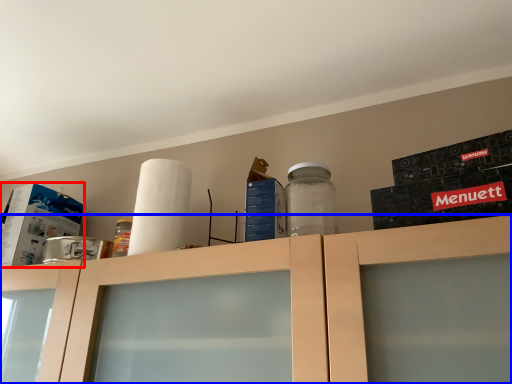
Question: Among these objects, which one is nearest to the camera, box (highlighted by a red box) or cabinetry (highlighted by a blue box)?

Choices:
 (A) box
 (B) cabinetry

Answer: (B)